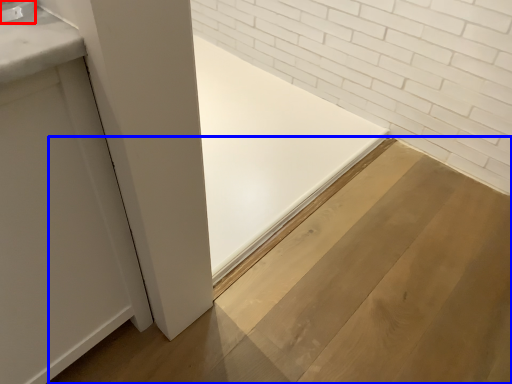
Question: Among these objects, which one is farthest to the camera, faucet (highlighted by a red box) or plywood (highlighted by a blue box)?

Choices:
 (A) faucet
 (B) plywood

Answer: (B)